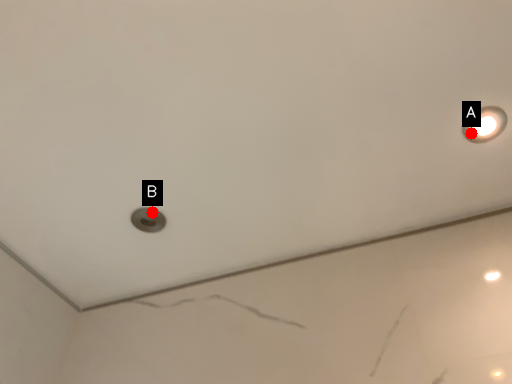
Question: Two points are circled on the image, labeled by A and B beside each circle. Which point is further to the camera?

Choices:
 (A) A is further
 (B) B is further

Answer: (B)